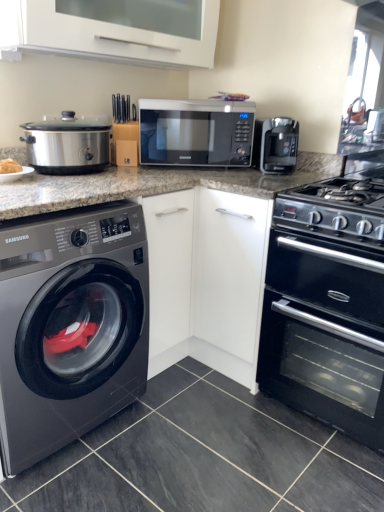
Question: Is satin black washing machine at left at the back of satin silver microwave at center?

Choices:
 (A) no
 (B) yes

Answer: (A)

Question: From a real-world perspective, is satin silver microwave at center located beneath satin black washing machine at left?

Choices:
 (A) no
 (B) yes

Answer: (A)

Question: Does satin silver microwave at center appear on the left side of satin black washing machine at left?

Choices:
 (A) no
 (B) yes

Answer: (A)

Question: Can you confirm if satin silver microwave at center is smaller than satin black washing machine at left?

Choices:
 (A) yes
 (B) no

Answer: (A)

Question: From the image's perspective, does satin silver microwave at center appear higher than satin black washing machine at left?

Choices:
 (A) no
 (B) yes

Answer: (B)

Question: Is satin silver microwave at center to the left or to the right of white glossy vent at upper center in the image?

Choices:
 (A) left
 (B) right

Answer: (B)

Question: Considering the positions of point (200, 129) and point (94, 55), is point (200, 129) closer or farther from the camera than point (94, 55)?

Choices:
 (A) farther
 (B) closer

Answer: (A)

Question: Considering their positions, is satin silver microwave at center located in front of or behind white glossy vent at upper center?

Choices:
 (A) behind
 (B) front

Answer: (A)

Question: From a real-world perspective, is satin silver microwave at center positioned above or below white glossy vent at upper center?

Choices:
 (A) above
 (B) below

Answer: (B)

Question: From the image's perspective, relative to white glossy vent at upper center, is satin black washing machine at left above or below?

Choices:
 (A) above
 (B) below

Answer: (B)

Question: Is satin black washing machine at left wider or thinner than white glossy vent at upper center?

Choices:
 (A) wide
 (B) thin

Answer: (A)

Question: Is point (3, 233) positioned closer to the camera than point (77, 2)?

Choices:
 (A) farther
 (B) closer

Answer: (B)

Question: In terms of height, does satin black washing machine at left look taller or shorter compared to white glossy vent at upper center?

Choices:
 (A) tall
 (B) short

Answer: (A)

Question: Considering their positions, is satin silver microwave at center located in front of or behind stainless steel slow cooker at left?

Choices:
 (A) front
 (B) behind

Answer: (B)

Question: From the image's perspective, is satin silver microwave at center positioned above or below stainless steel slow cooker at left?

Choices:
 (A) above
 (B) below

Answer: (A)